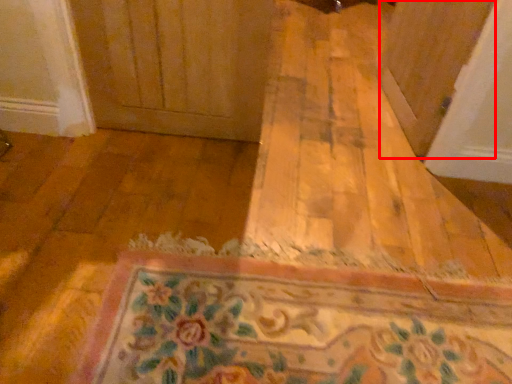
Question: From the image's perspective, where is screen door (annotated by the red box) located relative to bath mat?

Choices:
 (A) below
 (B) above

Answer: (B)